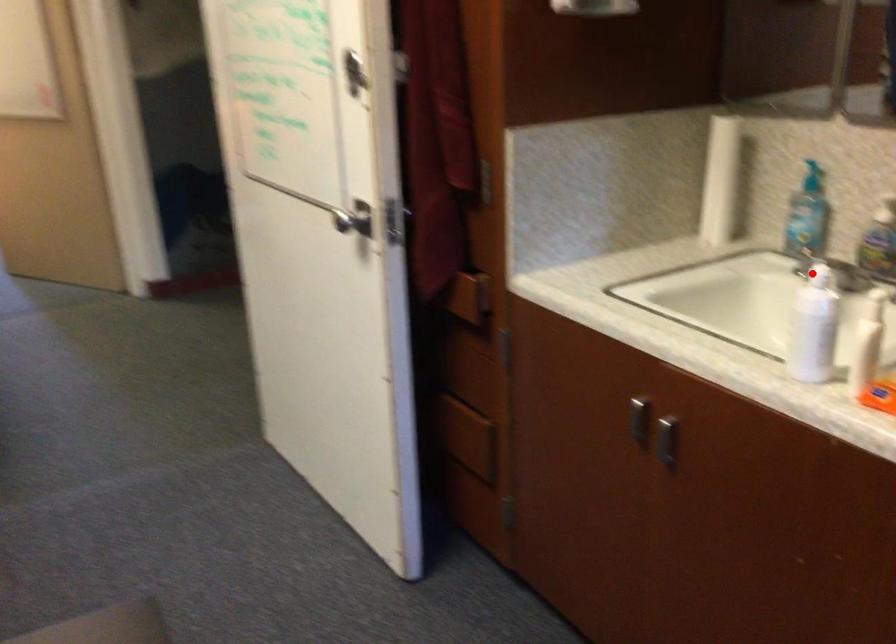
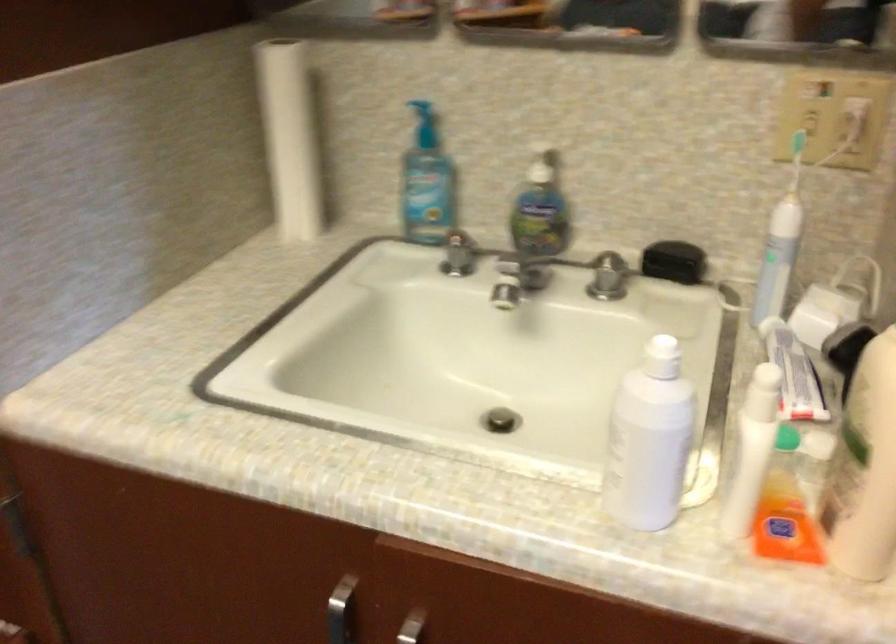
Question: I am providing you with two images of the same scene from different viewpoints. In image1, a red point is highlighted. Considering the same 3D point in image2, which of the following is correct?

Choices:
 (A) It is closer
 (B) It is farther

Answer: (A)